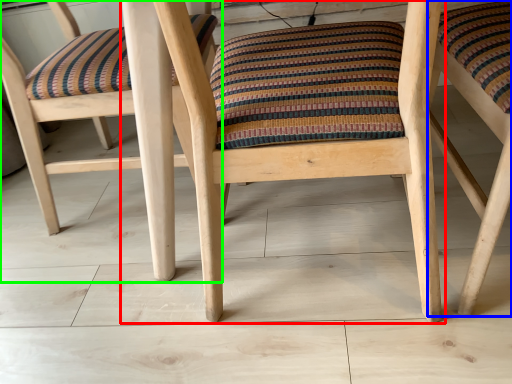
Question: Considering the real-world distances, which object is farthest from chair (highlighted by a red box)? chair (highlighted by a blue box) or chair (highlighted by a green box)?

Choices:
 (A) chair
 (B) chair

Answer: (A)